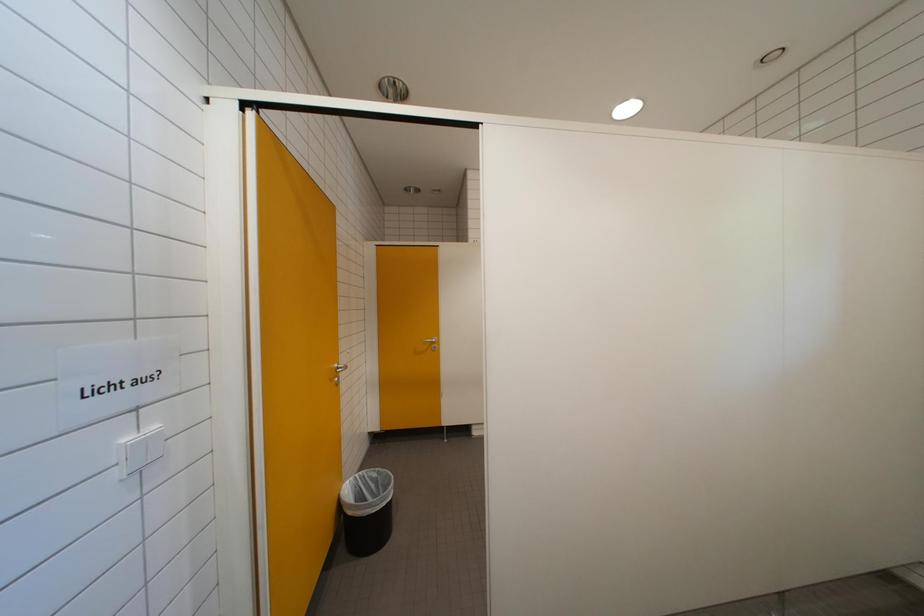
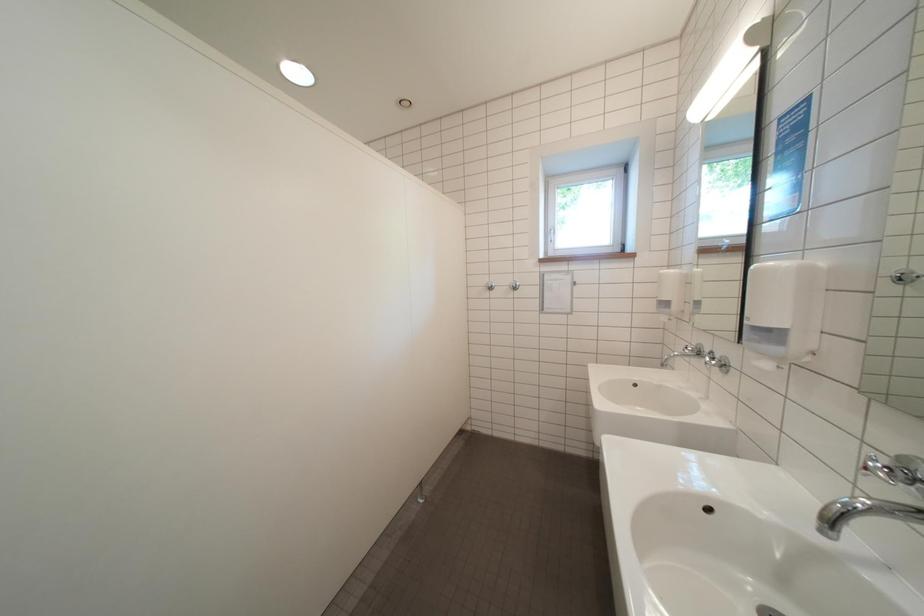
Question: The camera is either moving clockwise (left) or counter-clockwise (right) around the object. The first image is from the beginning of the video and the second image is from the end. Is the camera moving left or right when shooting the video?

Choices:
 (A) Left
 (B) Right

Answer: (A)